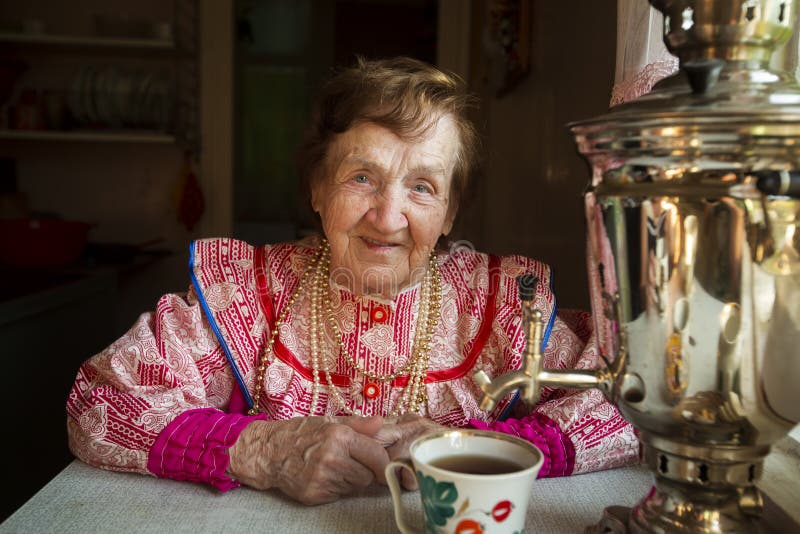
Identify the location of cup. (464, 504).